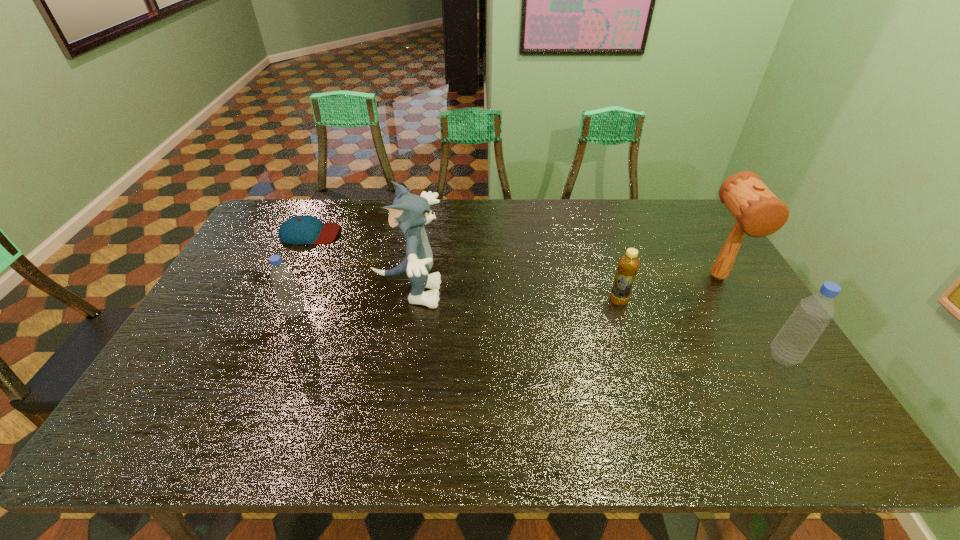
To achieve even spacing by inserting another bottle among them, please point to a vacant spot for this new bottle. Please provide its 2D coordinates. Your answer should be formatted as a tuple, i.e. [(x, y)], where the tuple contains the x and y coordinates of a point satisfying the conditions above.

[(527, 333)]